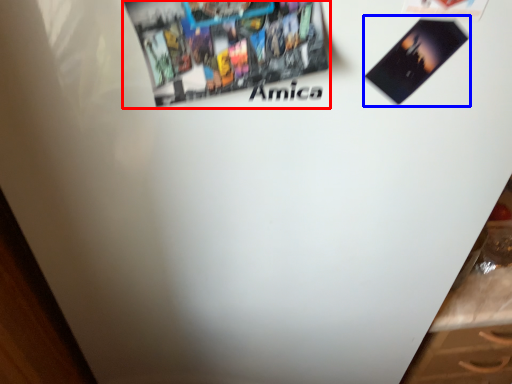
Question: Which object appears closest to the camera in this image, poster (highlighted by a red box) or flyer (highlighted by a blue box)?

Choices:
 (A) poster
 (B) flyer

Answer: (A)